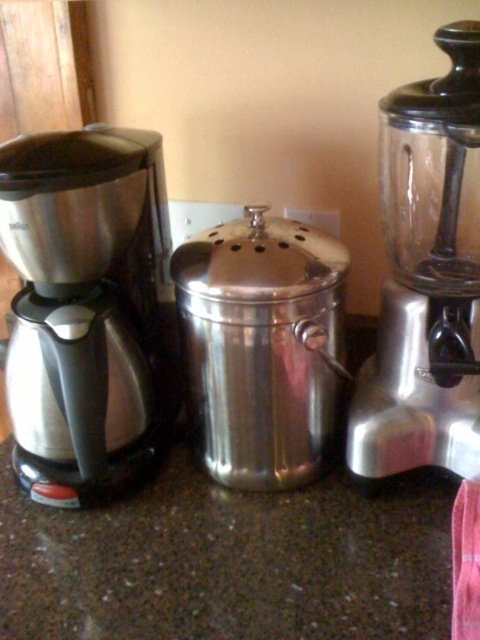
Between point (90, 364) and point (393, 134), which one is positioned behind?

Positioned behind is point (90, 364).

Which is more to the left, brushed metal coffee maker at left or satin silver blender at right?

brushed metal coffee maker at left is more to the left.

Image resolution: width=480 pixels, height=640 pixels. I want to click on brushed metal coffee maker at left, so click(x=84, y=305).

The image size is (480, 640). I want to click on brushed metal coffee maker at left, so click(x=84, y=305).